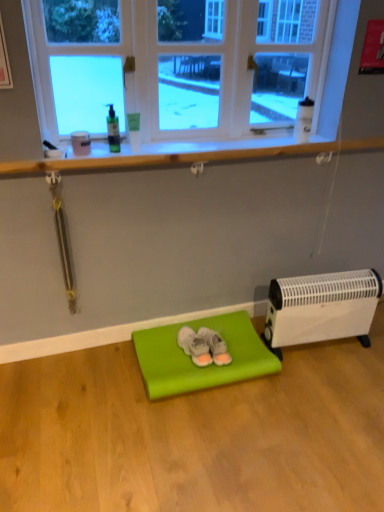
At what (x,y) coordinates should I click in order to perform the action: click on empty space that is to the right of gray suede slippers at center, acting as the 1th footwear starting from the left. Please return your answer as a coordinate pair (x, y). Image resolution: width=384 pixels, height=512 pixels. Looking at the image, I should click on [x=248, y=354].